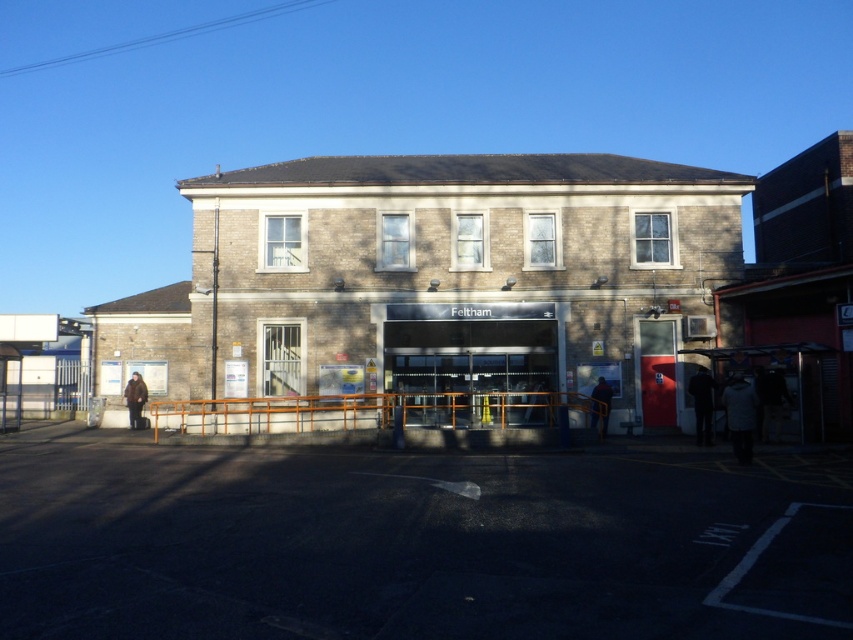
Is white fabric at center to the right of brown fuzzy coat at lower left from the viewer's perspective?

Indeed, white fabric at center is positioned on the right side of brown fuzzy coat at lower left.

This screenshot has height=640, width=853. What do you see at coordinates (740, 416) in the screenshot?
I see `white fabric at center` at bounding box center [740, 416].

Where is `white fabric at center`? This screenshot has height=640, width=853. white fabric at center is located at coordinates (740, 416).

Can you confirm if dark clothing at right is bigger than dark blue jacket at right?

Incorrect, dark clothing at right is not larger than dark blue jacket at right.

Which is more to the left, dark clothing at right or dark blue jacket at right?

dark blue jacket at right is more to the left.

Locate an element on the screen. dark clothing at right is located at coordinates tap(773, 403).

Which is behind, point (773, 376) or point (126, 388)?

Point (126, 388)

Find the location of a particular element. The height and width of the screenshot is (640, 853). dark clothing at right is located at coordinates (773, 403).

Who is more distant from viewer, (778, 388) or (132, 424)?

The point (132, 424) is behind.

In order to click on dark clothing at right in this screenshot , I will do `click(773, 403)`.